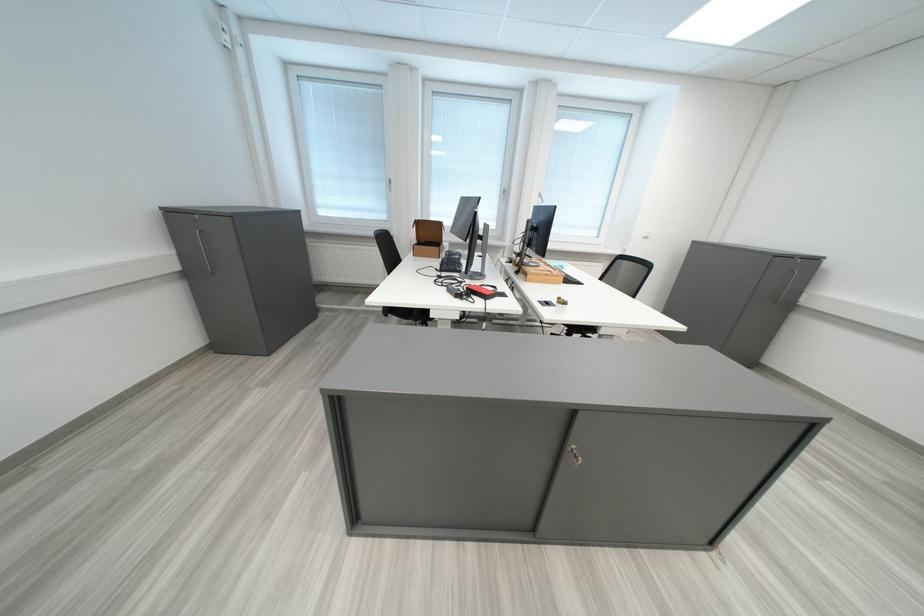
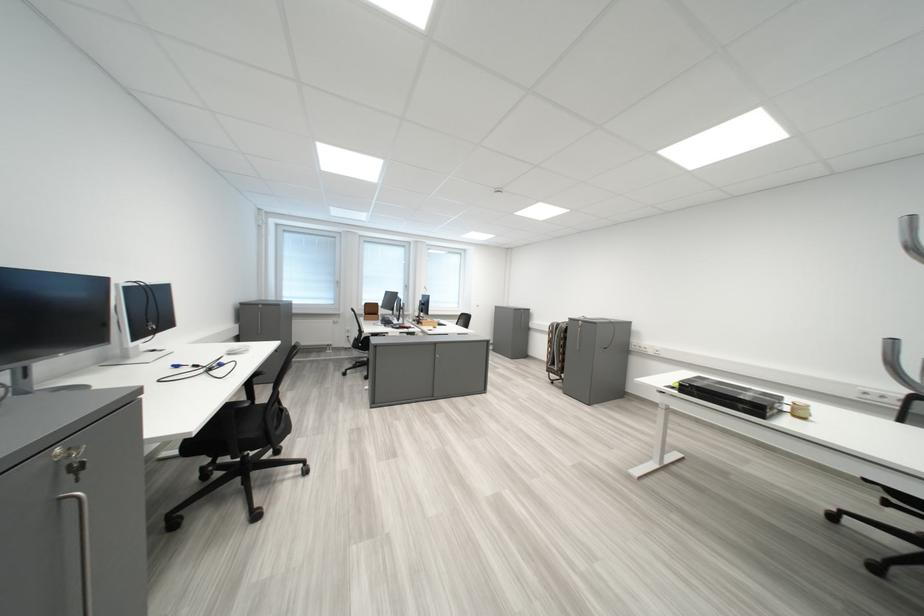
Question: The images are taken continuously from a first-person perspective. In which direction are you moving?

Choices:
 (A) Left
 (B) Right
 (C) Forward
 (D) Backward

Answer: (D)